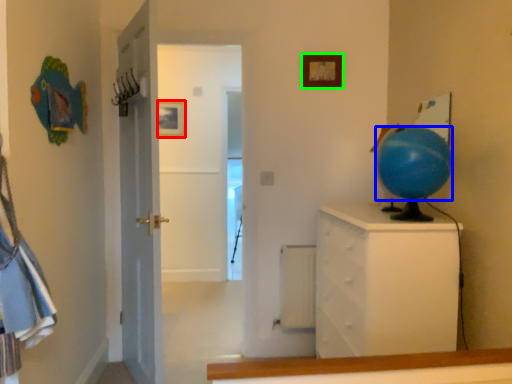
Question: Estimate the real-world distances between objects in this image. Which object is farther from picture frame (highlighted by a red box), balloon (highlighted by a blue box) or picture frame (highlighted by a green box)?

Choices:
 (A) balloon
 (B) picture frame

Answer: (A)